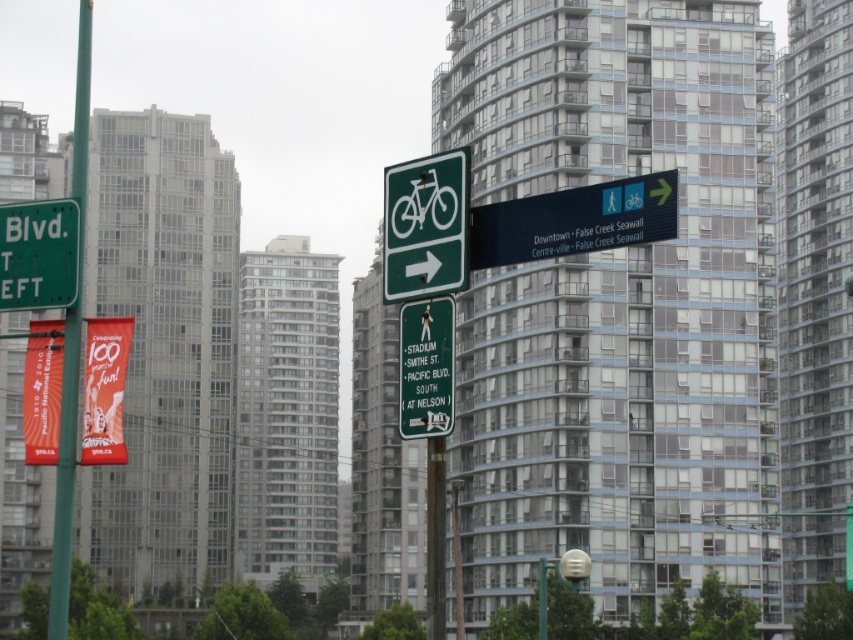
You are standing at the point closer to the camera in the image. Which point are you at, point (405, 211) or point (22, 221)?

You are at point (405, 211) because it is closer to the camera than point (22, 221).